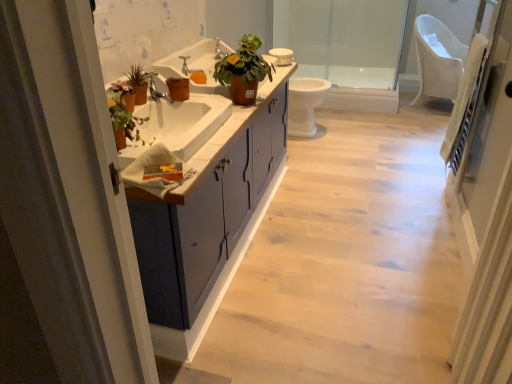
At what (x,y) coordinates should I click in order to perform the action: click on vacant space that's between white textured screen door at right and matte gray cabinet at center. Please return your answer as a coordinate pair (x, y). Looking at the image, I should click on (322, 291).